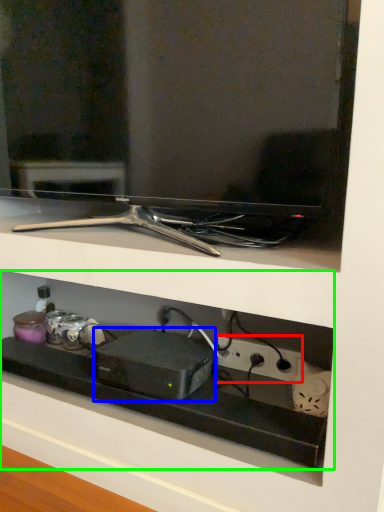
Question: Considering the real-world distances, which object is farthest from electric outlet (highlighted by a red box)? appliance (highlighted by a blue box) or shelf (highlighted by a green box)?

Choices:
 (A) appliance
 (B) shelf

Answer: (B)